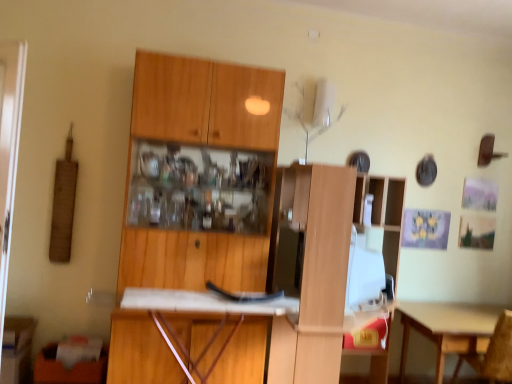
Question: From a real-world perspective, is wooden cabinet at center, the first cabinetry from the right, physically located above or below wooden chair at lower right?

Choices:
 (A) below
 (B) above

Answer: (B)

Question: Is wooden cabinet at center, the first cabinetry from the right, inside or outside of wooden chair at lower right?

Choices:
 (A) inside
 (B) outside

Answer: (B)

Question: Which object is the closest to the wooden cabinet at lower left, the 2th cabinetry when ordered from right to left?

Choices:
 (A) wooden chair at lower right
 (B) wooden cabinet at center, the first cabinetry from the right
 (C) white matte desk at center
 (D) light brown wooden table at lower right

Answer: (C)

Question: Which object is the farthest from the wooden chair at lower right?

Choices:
 (A) white matte desk at center
 (B) wooden cabinet at lower left, which ranks as the 1th cabinetry in left-to-right order
 (C) light brown wooden table at lower right
 (D) wooden cabinet at center, arranged as the second cabinetry when viewed from the left

Answer: (B)